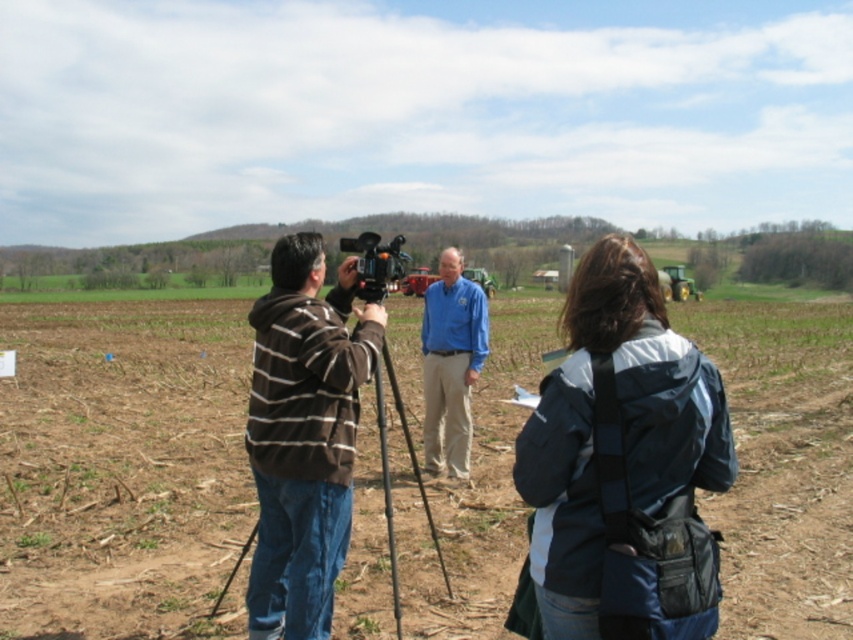
You are part of a film crew setting up for an interview in a farm field. You need to position a microphone so that it can capture the voice of the person in the blue cotton shirt at center without picking up the sound of the camera. Based on the scene description, where should you place the microphone relative to the black metal tripod at center?

The blue cotton shirt at center is above the black metal tripod at center, so placing the microphone above the black metal tripod at center, closer to the blue cotton shirt at center, would position it to capture their voice while avoiding the camera noise.

You are part of a film crew setting up for an interview. You need to ensure the subject wearing the blue cotton shirt at center is fully visible in the camera frame. The camera is mounted on the black metal tripod at center. Based on the scene description, will the subject be visible from head to toe in the current setup?

The blue cotton shirt at center has a greater height compared to the black metal tripod at center. Since the subject is taller than the tripod, adjusting the camera angle slightly downward should ensure the entire subject is visible from head to toe.

You are a camera operator trying to set up a shot where the brown striped hoodie at center and the black metal tripod at center are both in frame. The camera has a minimum focus distance of 1 meter. Will both objects be in focus?

The brown striped hoodie at center is 1.06 meters from the black metal tripod at center. Since the minimum focus distance is 1 meter, the distance between them is just over the threshold, so both objects should be in focus as long as they are within the camera sensor range.